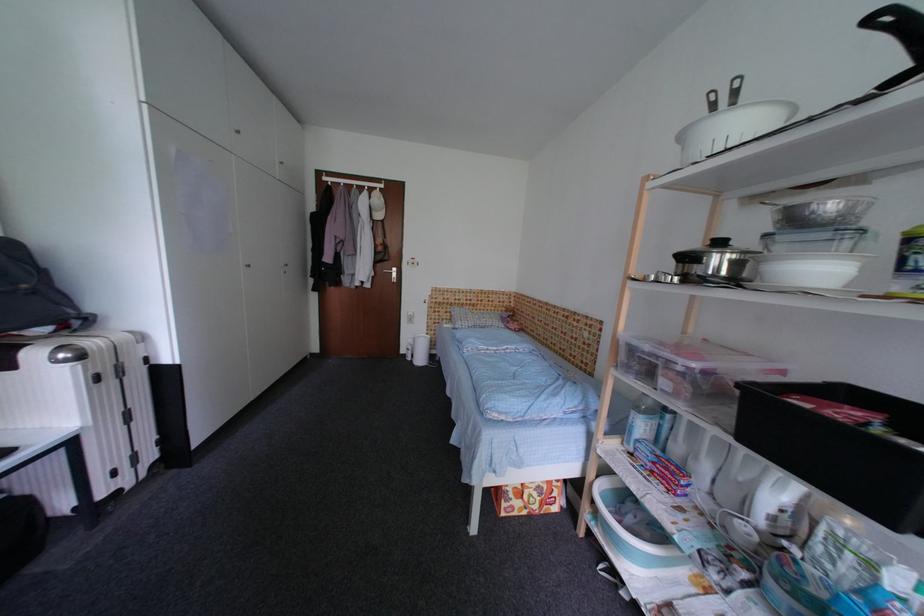
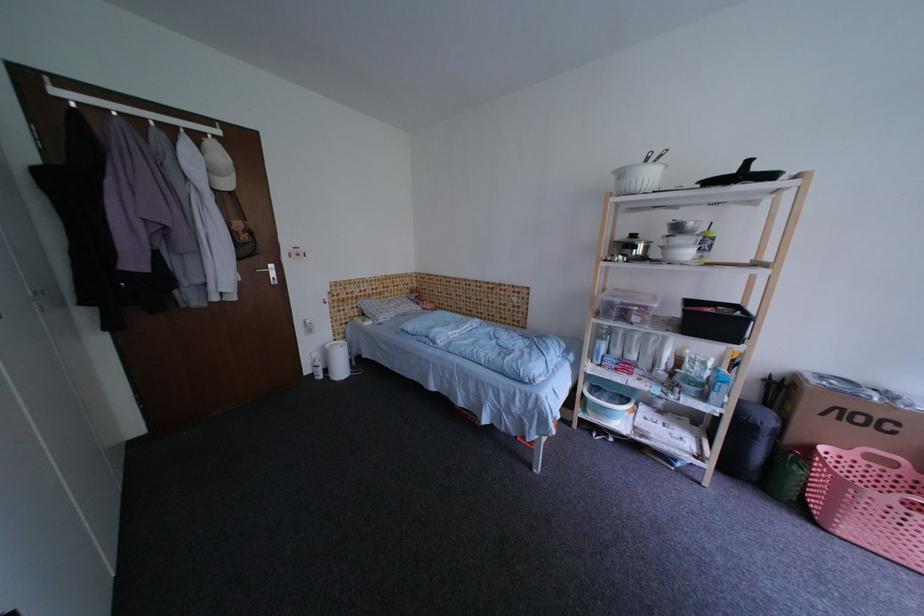
The point at (727, 245) is marked in the first image. Where is the corresponding point in the second image?

(641, 238)